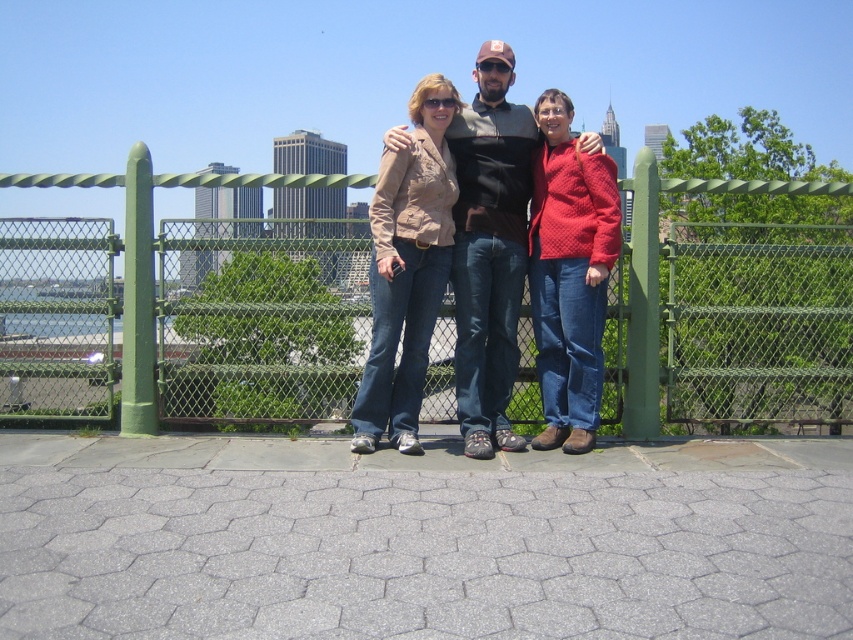
Consider the image. You are a photographer trying to capture a clear shot of the city skyline through the gap between the matte brown blazer at center and the knitted red sweater at center. Based on their positions, can you see the skyline clearly?

The matte brown blazer at center is located above the knitted red sweater at center, so the gap between them is narrow at the bottom. This might block the view of the city skyline behind the greenery.

You are a photographer trying to capture a group photo of the matte brown blazer at center and the knitted red sweater at center. Since you want to ensure both subjects are fully visible in the frame, which clothing item requires a wider lens setting to accommodate its size?

The matte brown blazer at center requires a wider lens setting because its width is larger than the knitted red sweater at center.